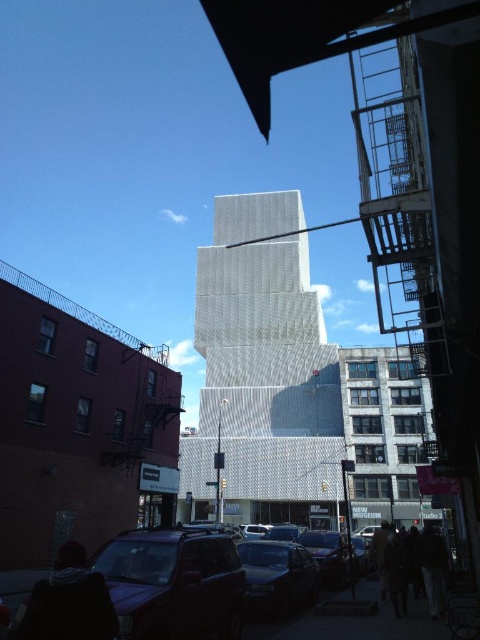
From the picture: You are standing at the center of the image and want to pick up the dark gray hoodie at lower left. In which direction should you move to reach it?

You should move to the lower left direction to reach the dark gray hoodie at lower left since its 2D location is at point (x=69, y=602).

You are a delivery driver who needs to park your matte black suv at lower left in a designated parking spot located at coordinates point 0.912, 0.362. Is your current position correct?

Yes, the matte black suv at lower left is already positioned at point (173, 582), so it is correctly parked in the designated spot.

You are a pedestrian standing on the sidewalk and see the dark gray hoodie at lower left and the metallic silver car at center. Which object is closer to the street?

The dark gray hoodie at lower left is positioned on the left side of the metallic silver car at center, so the metallic silver car at center is closer to the street than the dark gray hoodie at lower left.